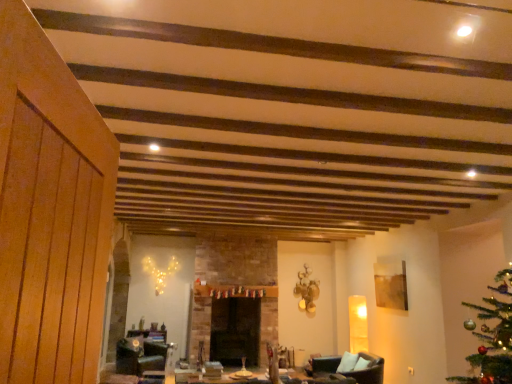
Question: Considering the relative sizes of black stone fireplace at center and black leather swivel chair at lower center in the image provided, is black stone fireplace at center wider than black leather swivel chair at lower center?

Choices:
 (A) no
 (B) yes

Answer: (A)

Question: Is there a large distance between black stone fireplace at center and black leather swivel chair at lower center?

Choices:
 (A) no
 (B) yes

Answer: (B)

Question: Considering the relative positions of black stone fireplace at center and black leather swivel chair at lower center in the image provided, is black stone fireplace at center in front of black leather swivel chair at lower center?

Choices:
 (A) yes
 (B) no

Answer: (B)

Question: Considering the relative sizes of black stone fireplace at center and black leather swivel chair at lower center in the image provided, is black stone fireplace at center smaller than black leather swivel chair at lower center?

Choices:
 (A) no
 (B) yes

Answer: (A)

Question: From the image's perspective, is black stone fireplace at center under black leather swivel chair at lower center?

Choices:
 (A) yes
 (B) no

Answer: (B)

Question: Considering the positions of brown leather armchair at lower right and black leather swivel chair at lower center in the image, is brown leather armchair at lower right bigger or smaller than black leather swivel chair at lower center?

Choices:
 (A) big
 (B) small

Answer: (A)

Question: Considering the positions of point (322, 360) and point (150, 347), is point (322, 360) closer or farther from the camera than point (150, 347)?

Choices:
 (A) farther
 (B) closer

Answer: (B)

Question: From a real-world perspective, is brown leather armchair at lower right positioned above or below black leather swivel chair at lower center?

Choices:
 (A) below
 (B) above

Answer: (B)

Question: From the image's perspective, relative to black leather swivel chair at lower center, is brown leather armchair at lower right above or below?

Choices:
 (A) below
 (B) above

Answer: (B)

Question: From the image's perspective, is brown leather armchair at lower right located above or below black stone fireplace at center?

Choices:
 (A) above
 (B) below

Answer: (A)

Question: In terms of height, does brown leather armchair at lower right look taller or shorter compared to black stone fireplace at center?

Choices:
 (A) tall
 (B) short

Answer: (B)

Question: From a real-world perspective, is brown leather armchair at lower right positioned above or below black stone fireplace at center?

Choices:
 (A) above
 (B) below

Answer: (B)

Question: Considering the positions of brown leather armchair at lower right and black stone fireplace at center in the image, is brown leather armchair at lower right wider or thinner than black stone fireplace at center?

Choices:
 (A) thin
 (B) wide

Answer: (B)

Question: Considering the positions of point pyautogui.click(x=158, y=347) and point pyautogui.click(x=216, y=317), is point pyautogui.click(x=158, y=347) closer or farther from the camera than point pyautogui.click(x=216, y=317)?

Choices:
 (A) closer
 (B) farther

Answer: (A)

Question: From the image's perspective, is black leather swivel chair at lower center located above or below black stone fireplace at center?

Choices:
 (A) above
 (B) below

Answer: (B)